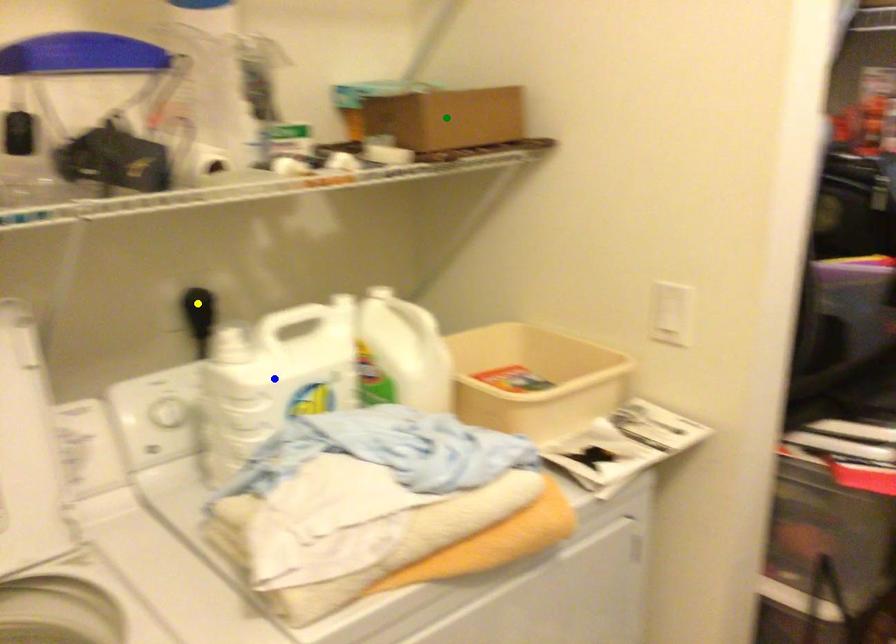
Order these from nearest to farthest:
blue point, green point, yellow point

blue point → green point → yellow point